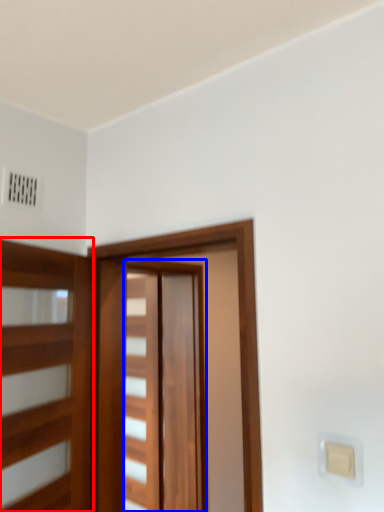
Question: Among these objects, which one is nearest to the camera, elevator (highlighted by a red box) or barn door (highlighted by a blue box)?

Choices:
 (A) elevator
 (B) barn door

Answer: (A)